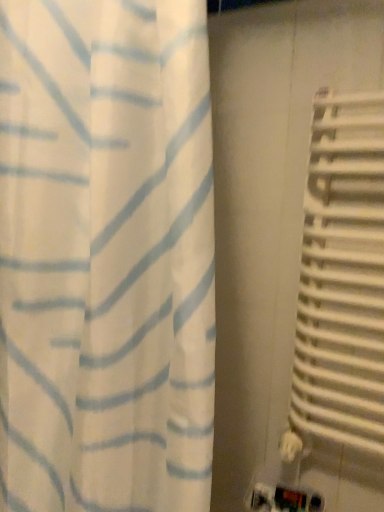
Question: Considering their positions, is white fabric curtain at left located in front of or behind white metallic radiator at right?

Choices:
 (A) behind
 (B) front

Answer: (B)

Question: In the image, is white fabric curtain at left on the left side or the right side of white metallic radiator at right?

Choices:
 (A) right
 (B) left

Answer: (B)

Question: From their relative heights in the image, would you say white fabric curtain at left is taller or shorter than white metallic radiator at right?

Choices:
 (A) short
 (B) tall

Answer: (B)

Question: From a real-world perspective, is white metallic radiator at right positioned above or below white fabric curtain at left?

Choices:
 (A) above
 (B) below

Answer: (B)

Question: Relative to white fabric curtain at left, is white metallic radiator at right in front or behind?

Choices:
 (A) behind
 (B) front

Answer: (A)

Question: Looking at the image, does white metallic radiator at right seem bigger or smaller compared to white fabric curtain at left?

Choices:
 (A) big
 (B) small

Answer: (B)

Question: Is white metallic radiator at right taller or shorter than white fabric curtain at left?

Choices:
 (A) short
 (B) tall

Answer: (A)